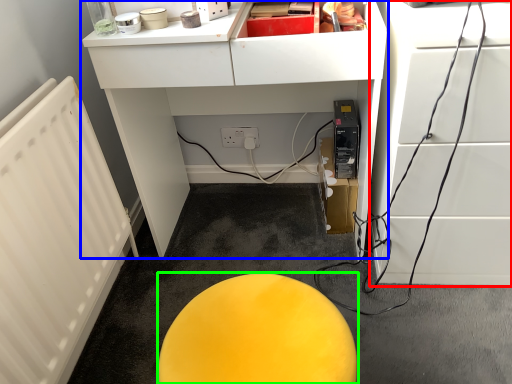
Question: Which object is the closest to the furniture (highlighted by a red box)? Choose among these: furniture (highlighted by a blue box) or furniture (highlighted by a green box).

Choices:
 (A) furniture
 (B) furniture

Answer: (A)